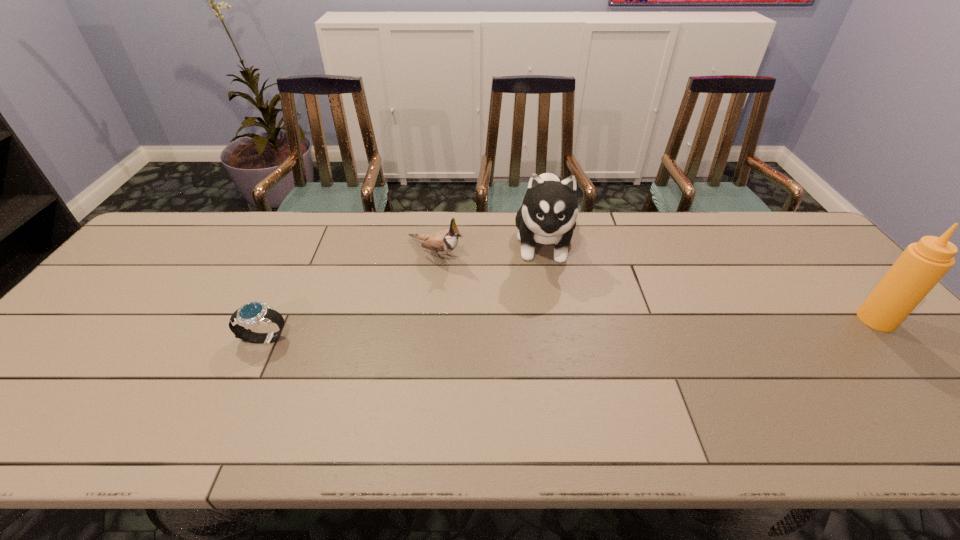
Where is `vacant space located 0.380m at the face of the puppy`? The height and width of the screenshot is (540, 960). vacant space located 0.380m at the face of the puppy is located at coordinates (549, 397).

At what (x,y) coordinates should I click in order to perform the action: click on free location located 0.290m at the face of the second object from left to right. Please return your answer as a coordinate pair (x, y). This screenshot has height=540, width=960. Looking at the image, I should click on (536, 312).

Find the location of `vacant space located at the face of the second object from left to right`. vacant space located at the face of the second object from left to right is located at coordinates (533, 310).

This screenshot has height=540, width=960. Find the location of `vacant space located at the face of the second object from left to right`. vacant space located at the face of the second object from left to right is located at coordinates (482, 280).

Where is `puppy that is at the far edge`? puppy that is at the far edge is located at coordinates (548, 214).

Identify the location of bird that is at the far edge. The height and width of the screenshot is (540, 960). (444, 241).

Identify the location of object that is at the right edge. The image size is (960, 540). (922, 265).

In order to click on free spot at the far edge of the desktop in this screenshot , I will do `click(591, 220)`.

The image size is (960, 540). In order to click on vacant area at the near edge of the desktop in this screenshot , I will do `click(118, 405)`.

Identify the location of free point at the left edge. The width and height of the screenshot is (960, 540). (84, 352).